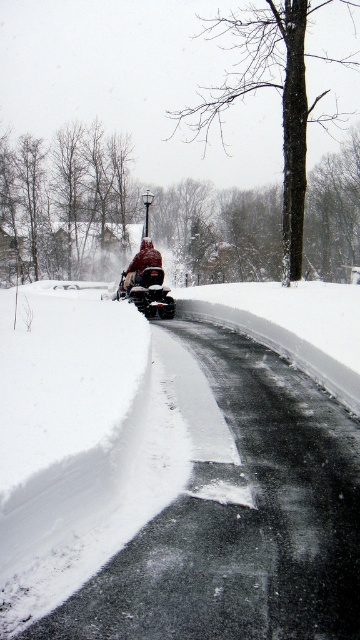
Does point (149, 314) come closer to viewer compared to point (124, 289)?

Yes, point (149, 314) is closer to viewer.

Consider the image. Is shiny red snowmobile at center above red knit hat at center?

No.

Who is more forward, (141, 280) or (129, 285)?

Point (141, 280)

The height and width of the screenshot is (640, 360). Identify the location of shiny red snowmobile at center. (146, 292).